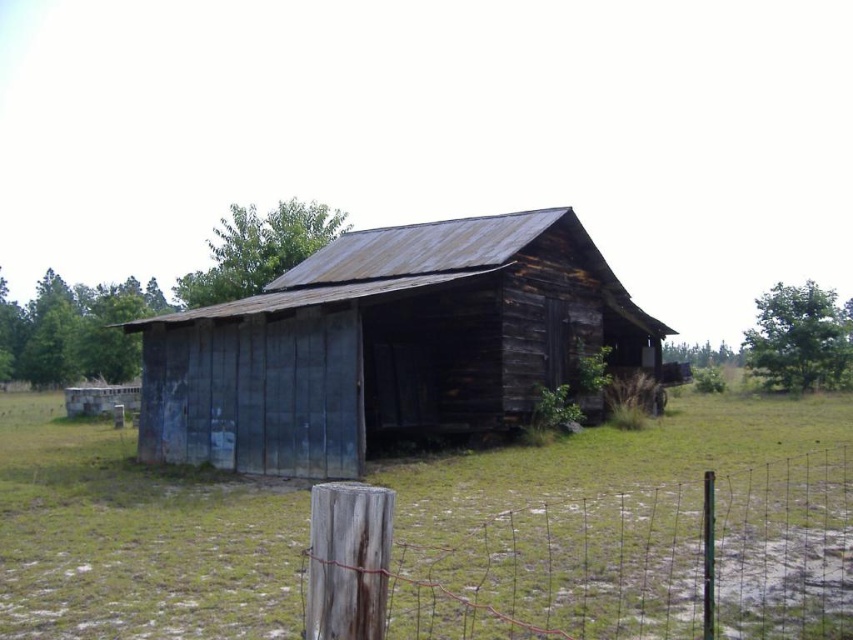
You are standing in the field near the weathered wood barn at center and the weathered wood post at lower left. If you walk straight towards the barn, will the post become visible or hidden from your view?

The weathered wood post at lower left is behind the weathered wood barn at center, so as you walk straight towards the barn, the post will become hidden from your view.

You are a gardener planning to plant a new flower bed in the area shown in the image. You need to choose between the green grass at center and the weathered wood post at lower left. Which location has more space available for planting?

The green grass at center has more space available for planting because it is larger in size than the weathered wood post at lower left.

You are standing in a field and see the green grass at center and the weathered wood barn at center. Which object is closer to you?

The green grass at center is closer to you because it is in front of the weathered wood barn at center.